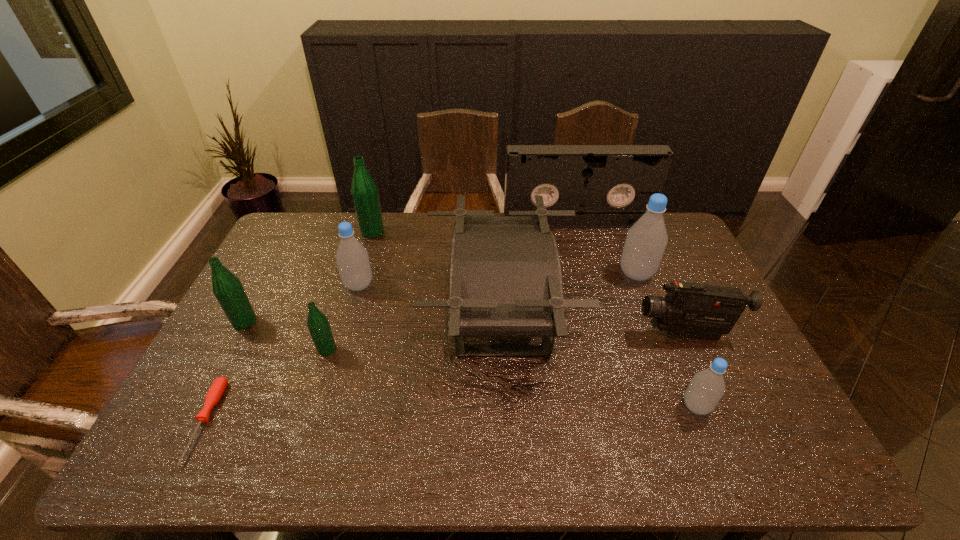
The width and height of the screenshot is (960, 540). I want to click on gray videotape, so click(x=608, y=186).

The height and width of the screenshot is (540, 960). I want to click on the biggest green bottle, so click(x=364, y=191).

At what (x,y) coordinates should I click in order to perform the action: click on the farthest bottle. Please return your answer as a coordinate pair (x, y). This screenshot has width=960, height=540. Looking at the image, I should click on (364, 191).

Find the location of a particular element. the biggest gray bottle is located at coordinates (646, 240).

Locate an element on the screen. Image resolution: width=960 pixels, height=540 pixels. drone is located at coordinates (505, 280).

I want to click on the leftmost gray bottle, so click(x=352, y=259).

At what (x,y) coordinates should I click in order to perform the action: click on the leftmost green bottle. Please return your answer as a coordinate pair (x, y). Looking at the image, I should click on 227,288.

Image resolution: width=960 pixels, height=540 pixels. In order to click on the second farthest green bottle in this screenshot , I will do `click(227, 288)`.

Where is `camcorder`? camcorder is located at coordinates (689, 309).

You are a GUI agent. You are given a task and a screenshot of the screen. Output one action in this format:
    pyautogui.click(x=<x>, y=<y>)
    Task: Click on the second nearest bottle
    This screenshot has width=960, height=540.
    Given the screenshot: What is the action you would take?
    pyautogui.click(x=318, y=324)